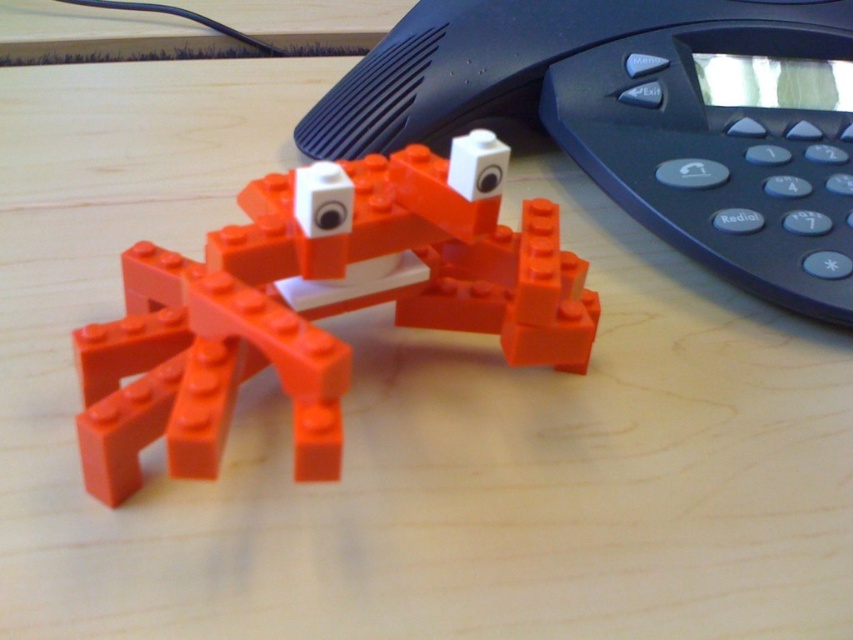
Can you confirm if black plastic phone at upper center is shorter than orange matte plastic crab at center?

No.

Who is higher up, black plastic phone at upper center or orange matte plastic crab at center?

Positioned higher is black plastic phone at upper center.

Find the location of a particular element. Image resolution: width=853 pixels, height=640 pixels. black plastic phone at upper center is located at coordinates (643, 118).